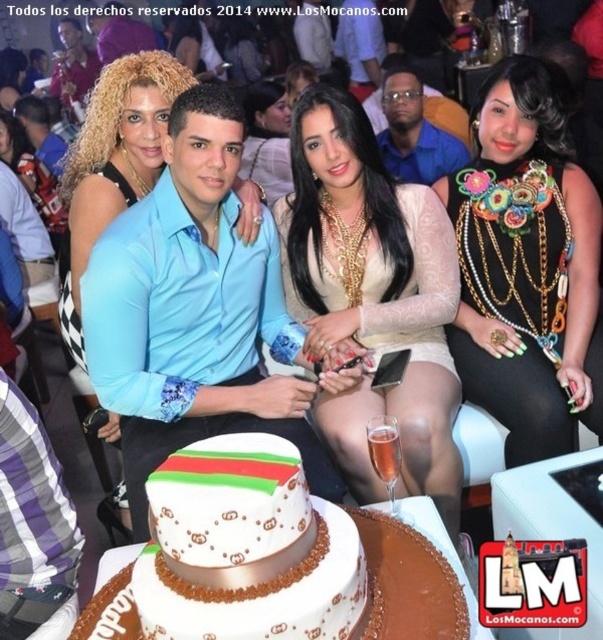
You are a photographer at the event and want to capture a closeup of the white fondant cake at center and the black fabric dress at center. Since your camera has a limited focus range, you need to know which object is wider. Which one is wider?

The white fondant cake at center is wider than the black fabric dress at center according to the description.

You are a photographer at a celebration and need to adjust the lighting so that both the white lace dress at center and the black fabric dress at center are equally visible. Which dress requires more light to ensure it is properly lit?

The black fabric dress at center requires more light because it is darker in color and absorbs more light, making it less visible compared to the white lace dress at center.

You are a photographer trying to adjust the lighting for a group photo. You notice the light blue shirt at center and the smooth beige dress at center. Which clothing item requires more space in the frame to avoid being cut off?

The light blue shirt at center is bigger than the smooth beige dress at center, so it requires more space in the frame to avoid being cut off.